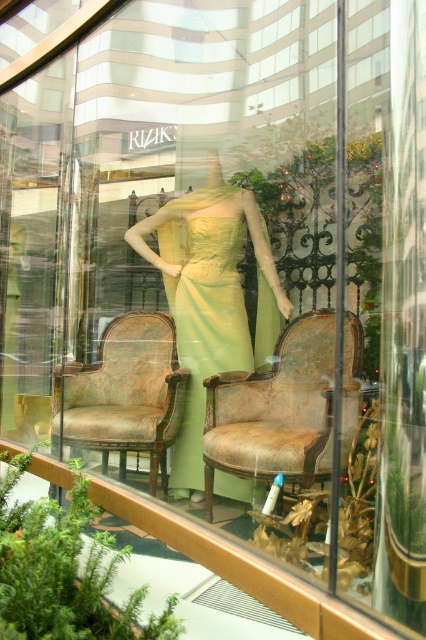
Can you confirm if distressed leather armchair at center is taller than distressed leather armchair at left?

Yes.

Who is higher up, distressed leather armchair at center or distressed leather armchair at left?

distressed leather armchair at left is higher up.

You are a GUI agent. You are given a task and a screenshot of the screen. Output one action in this format:
    pyautogui.click(x=<x>, y=<y>)
    Task: Click on the distressed leather armchair at center
    This screenshot has width=426, height=640.
    Given the screenshot: What is the action you would take?
    275,410

Does distressed leather armchair at center have a lesser width compared to lime green satin dress at center?

No, distressed leather armchair at center is not thinner than lime green satin dress at center.

Who is taller, distressed leather armchair at center or lime green satin dress at center?

lime green satin dress at center is taller.

I want to click on distressed leather armchair at center, so click(x=275, y=410).

I want to click on distressed leather armchair at center, so click(x=275, y=410).

Can you confirm if matte yellow dress at center is shorter than lime green satin dress at center?

In fact, matte yellow dress at center may be taller than lime green satin dress at center.

Does point (178, 458) come in front of point (236, 264)?

That is True.

The image size is (426, 640). Find the location of `matte yellow dress at center`. matte yellow dress at center is located at coordinates (210, 298).